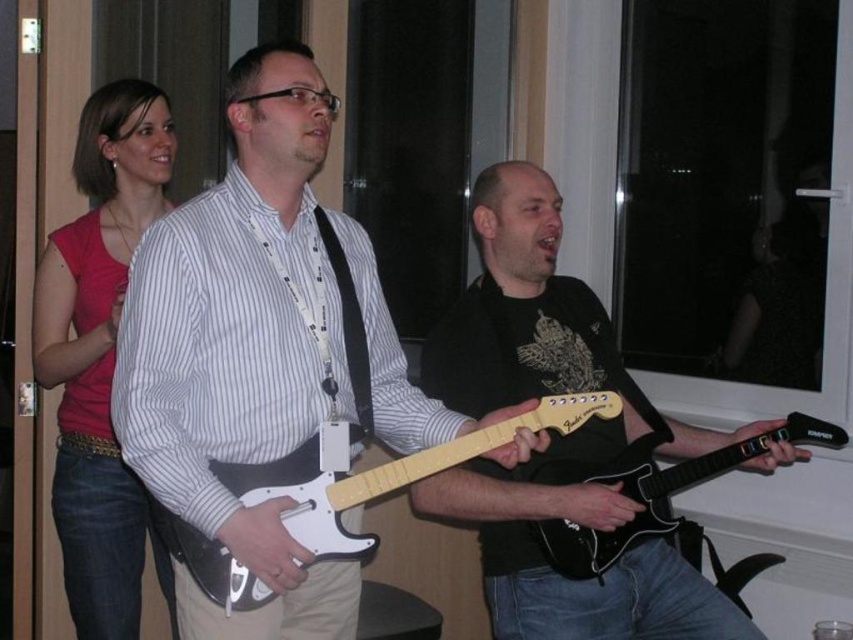
Question: Does black matte guitar at center appear under pink fabric shirt at upper left?

Choices:
 (A) no
 (B) yes

Answer: (B)

Question: Which of these objects is positioned closest to the pink fabric shirt at upper left?

Choices:
 (A) white matte guitar at center
 (B) black matte electric guitar at center

Answer: (A)

Question: Which point is closer to the camera taking this photo?

Choices:
 (A) (577, 321)
 (B) (428, 461)
 (C) (144, 492)

Answer: (B)

Question: Is the position of white matte electric guitar at center more distant than that of black matte electric guitar at center?

Choices:
 (A) yes
 (B) no

Answer: (B)

Question: Can you confirm if white matte guitar at center is positioned below black matte electric guitar at center?

Choices:
 (A) yes
 (B) no

Answer: (B)

Question: Which point is farther to the camera?

Choices:
 (A) white matte guitar at center
 (B) black matte electric guitar at center
 (C) pink fabric shirt at upper left

Answer: (C)